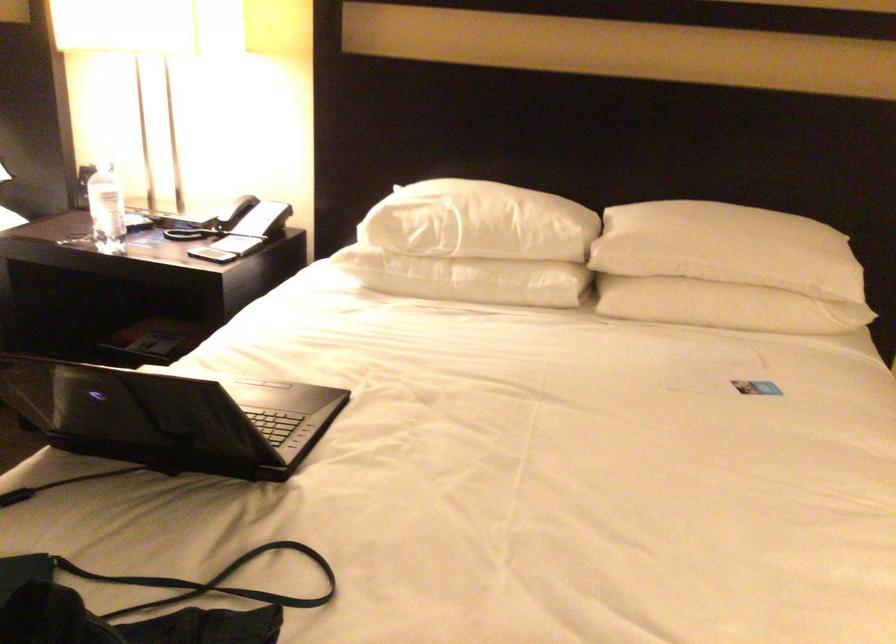
Describe the element at coordinates (106, 210) in the screenshot. The height and width of the screenshot is (644, 896). I see `a water bottle` at that location.